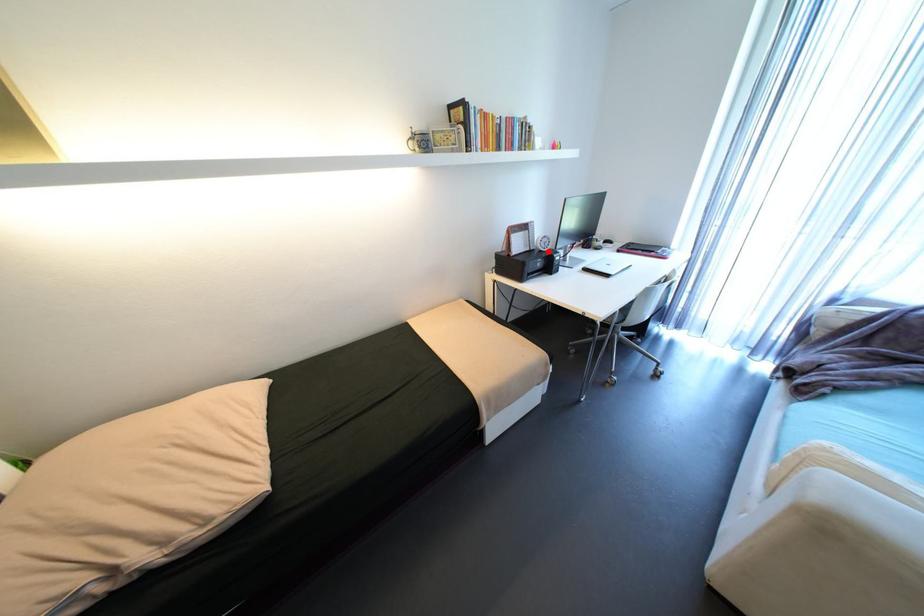
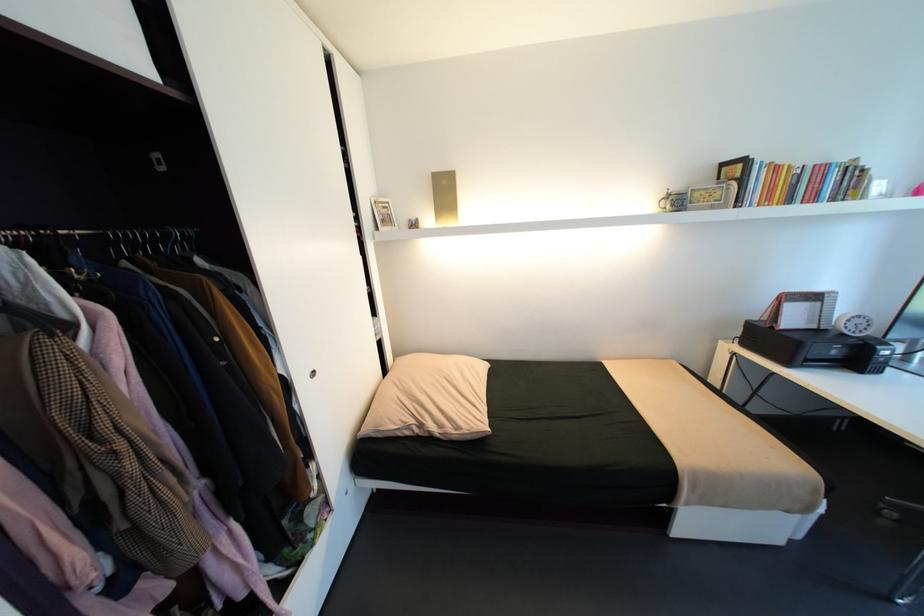
The point at the highlighted location is marked in the first image. Where is the corresponding point in the second image?

(850, 334)